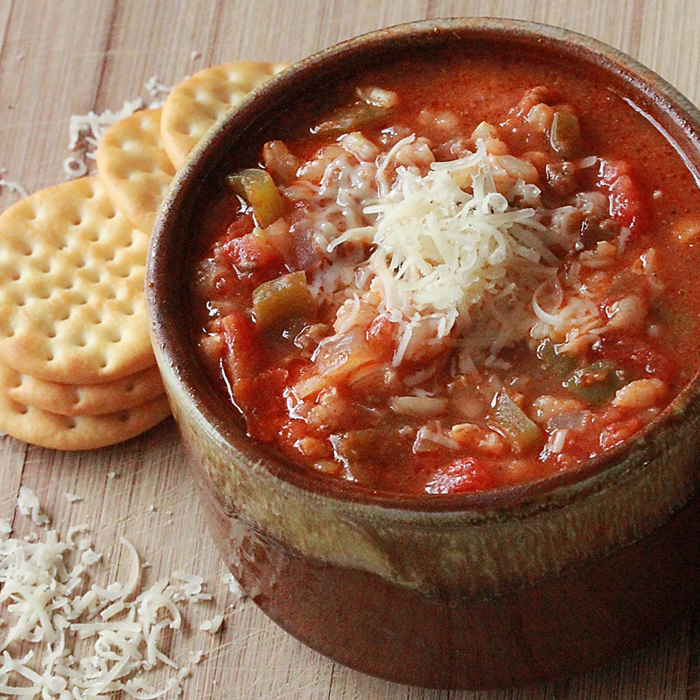
Locate an element on the screen. pottery bowls is located at coordinates (409, 539).